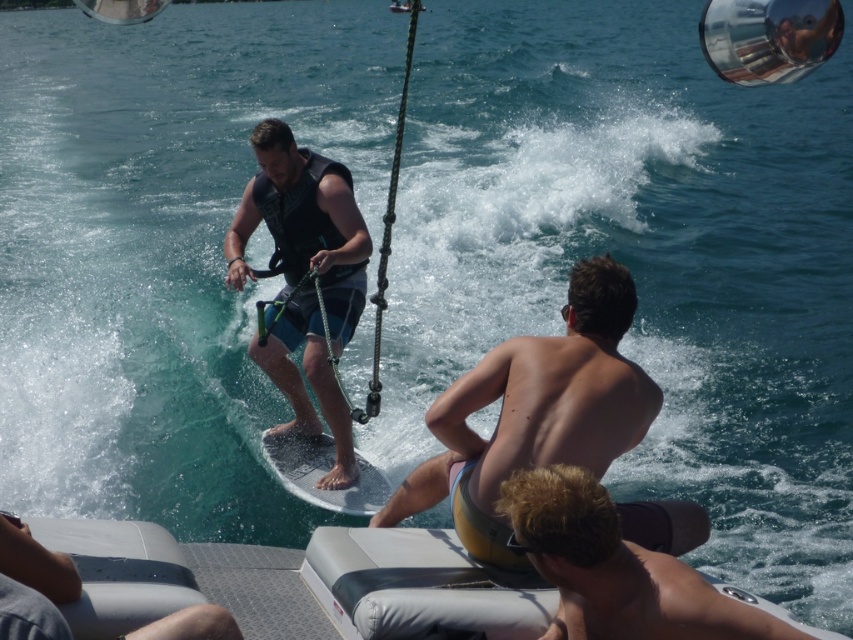
Who is positioned more to the left, dark blue fabric life vest at center or white glossy water ski at center?

From the viewer's perspective, dark blue fabric life vest at center appears more on the left side.

Is dark blue fabric life vest at center positioned in front of white glossy water ski at center?

No, dark blue fabric life vest at center is further to the viewer.

Where is `dark blue fabric life vest at center`? This screenshot has width=853, height=640. dark blue fabric life vest at center is located at coordinates (303, 225).

Does blonde hair at lower right have a smaller size compared to white glossy water ski at center?

No.

Is blonde hair at lower right wider than white glossy water ski at center?

Yes.

The height and width of the screenshot is (640, 853). I want to click on blonde hair at lower right, so click(614, 568).

Which is in front, point (306, 419) or point (700, 620)?

Point (700, 620) is in front.

Looking at this image, between dark blue fabric life vest at center and blonde hair at lower right, which one has less height?

blonde hair at lower right

Identify the location of dark blue fabric life vest at center. (303, 225).